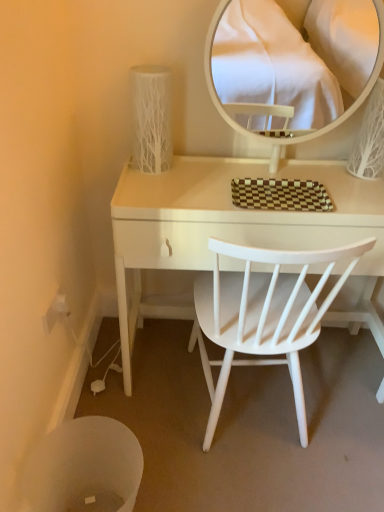
Find the location of a particular element. free space on the front side of white textured vase at upper left is located at coordinates (167, 183).